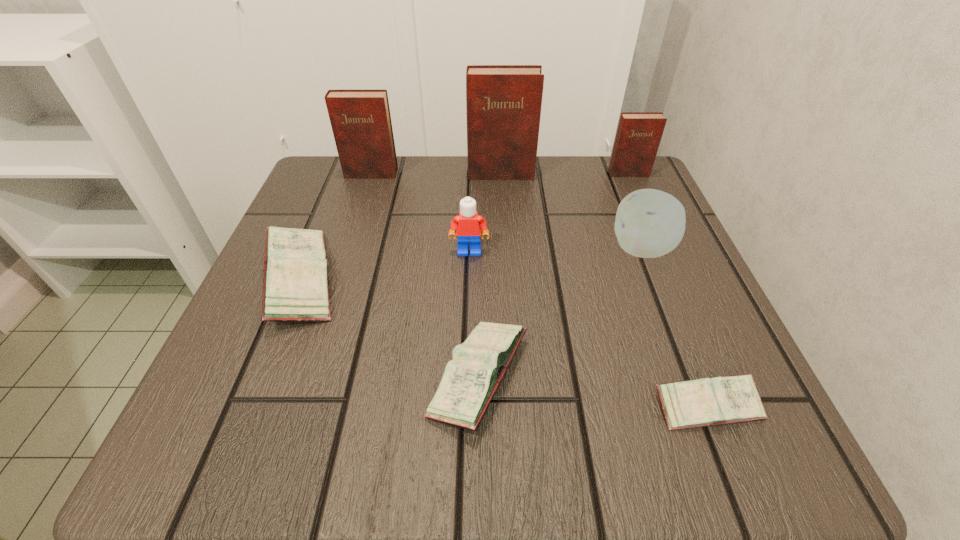
Identify the location of vacant space at the far right corner of the desktop. This screenshot has width=960, height=540. (620, 187).

Identify the location of free space at the near right corner of the desktop. (705, 444).

Identify the location of vacant area that lies between the apple and the third shortest diary. The image size is (960, 540). (471, 265).

The image size is (960, 540). Find the location of `free space between the leftmost pink diary and the white apple`. free space between the leftmost pink diary and the white apple is located at coordinates (471, 265).

The width and height of the screenshot is (960, 540). Find the location of `free area in between the rightmost reddish-brown diary and the white Lego`. free area in between the rightmost reddish-brown diary and the white Lego is located at coordinates (549, 213).

This screenshot has width=960, height=540. I want to click on free point between the tallest diary and the smallest pink diary, so click(x=604, y=290).

Where is `free space between the tallest object and the second shortest object`? free space between the tallest object and the second shortest object is located at coordinates (490, 275).

Find the location of `vacant space that's between the fifth tallest diary and the smallest reddish-brown diary`. vacant space that's between the fifth tallest diary and the smallest reddish-brown diary is located at coordinates (554, 275).

The width and height of the screenshot is (960, 540). Identify the location of object that ranks as the second closest to the seventh tallest object. (295, 286).

Identify which object is located as the third nearest to the tallest diary. Please provide its 2D coordinates. Your answer should be formatted as a tuple, i.e. [(x, y)], where the tuple contains the x and y coordinates of a point satisfying the conditions above.

[(650, 223)]